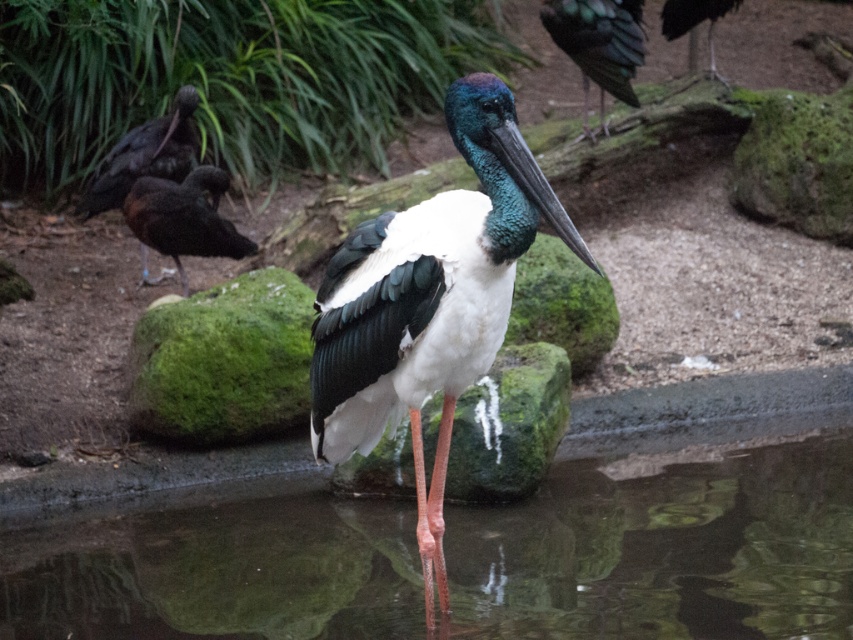
Who is more forward, (x=430, y=378) or (x=573, y=4)?

Positioned in front is point (x=430, y=378).

Looking at this image, does white glossy stork at center have a larger size compared to shiny green feathers at upper right?

Correct, white glossy stork at center is larger in size than shiny green feathers at upper right.

Does point (457, 330) lie behind point (611, 17)?

No, it is not.

Image resolution: width=853 pixels, height=640 pixels. What are the coordinates of `white glossy stork at center` in the screenshot? It's located at (428, 301).

In order to click on clear water at center in this screenshot , I will do `click(664, 550)`.

Can you confirm if clear water at center is positioned to the left of shiny black bird at upper right?

Correct, you'll find clear water at center to the left of shiny black bird at upper right.

Is point (347, 616) behind point (677, 8)?

No.

Where is `clear water at center`? clear water at center is located at coordinates (664, 550).

This screenshot has width=853, height=640. Describe the element at coordinates (184, 218) in the screenshot. I see `shiny black bird at left` at that location.

Which is above, shiny black bird at left or shiny black bird at upper right?

shiny black bird at upper right is higher up.

Who is more forward, (167, 234) or (672, 38)?

Positioned in front is point (167, 234).

Identify the location of shiny black bird at left. (184, 218).